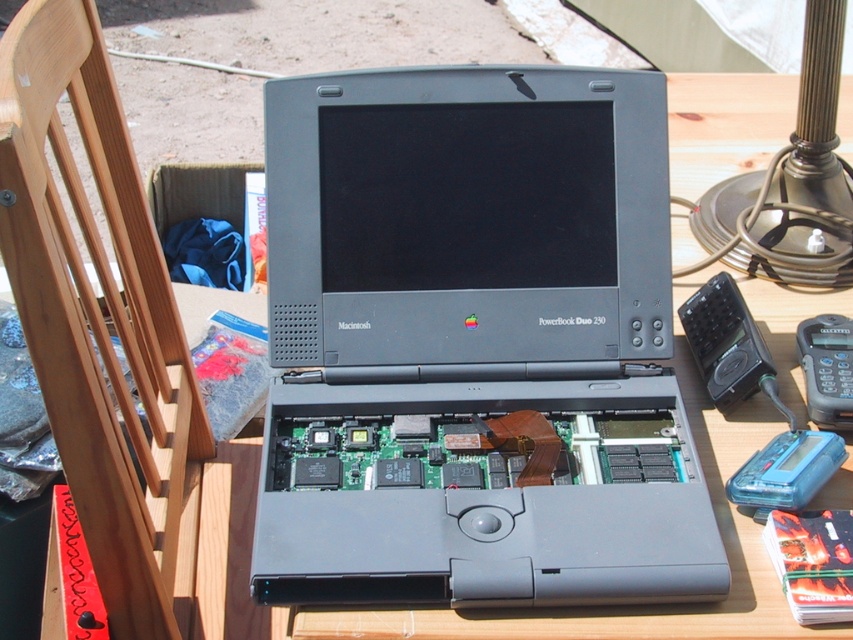
You are setting up a photography studio and need to place the matte gray laptop at center and the wooden at left on a shelf. Which object should you place first to ensure stability?

The wooden at left should be placed first because it is taller than the matte gray laptop at center, so placing it first ensures stability by having a larger base.

You are setting up a photography studio and need to position the matte gray laptop at center and the polished brass lamp at upper right. According to the scene, which object is positioned to the left of the other?

The matte gray laptop at center is positioned to the left of the polished brass lamp at upper right.